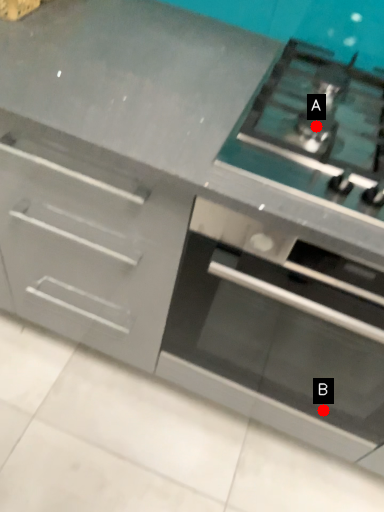
Question: Two points are circled on the image, labeled by A and B beside each circle. Which point is closer to the camera taking this photo?

Choices:
 (A) A is closer
 (B) B is closer

Answer: (A)